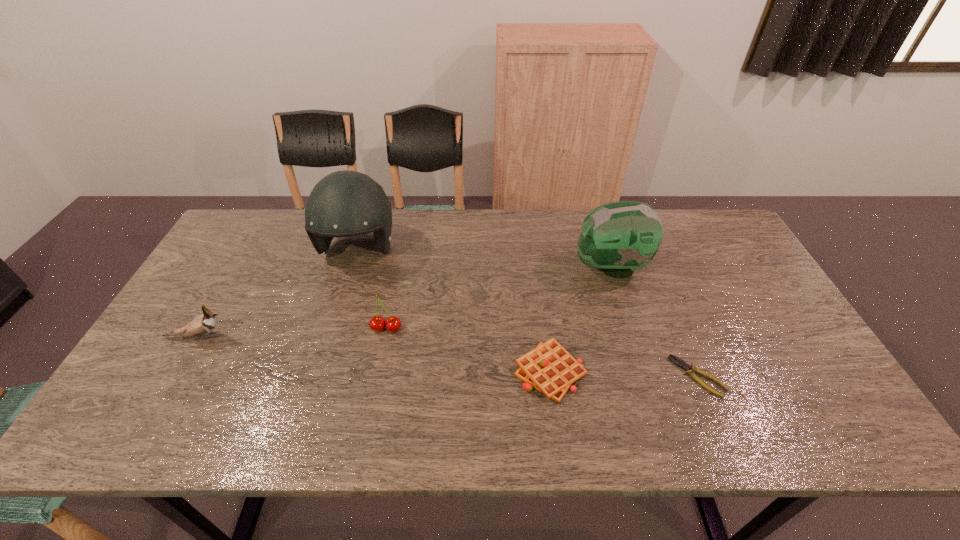
At what (x,y) coordinates should I click in order to perform the action: click on vacant position in the image that satisfies the following two spatial constraints: 1. on the back side of the pliers; 2. at the face of the leftmost object. Please return your answer as a coordinate pair (x, y). This screenshot has height=540, width=960. Looking at the image, I should click on (682, 338).